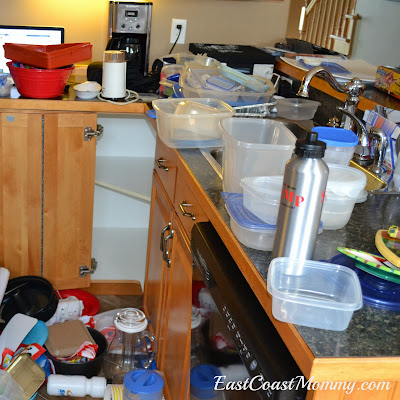
Locate an element on the screen. counter is located at coordinates (382, 326).